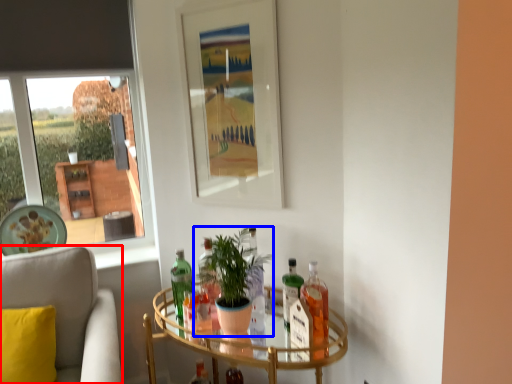
Question: Which of the following is the closest to the observer, chair (highlighted by a red box) or houseplant (highlighted by a blue box)?

Choices:
 (A) chair
 (B) houseplant

Answer: (A)